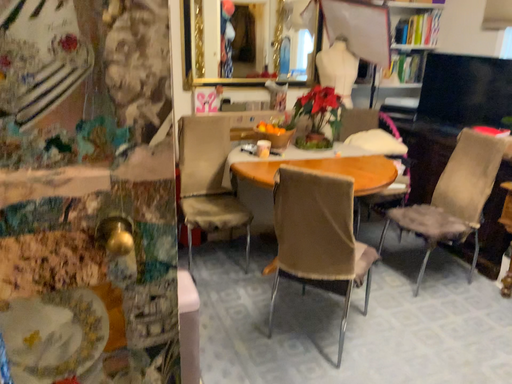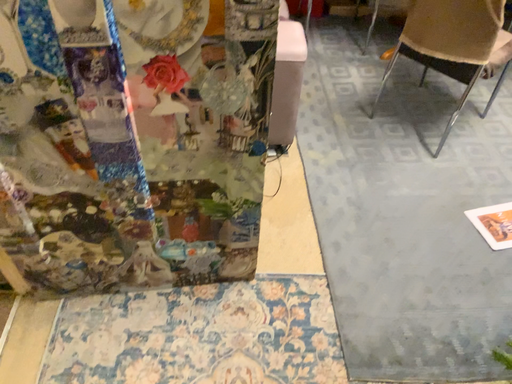
Question: How did the camera likely rotate when shooting the video?

Choices:
 (A) rotated upward
 (B) rotated downward

Answer: (B)